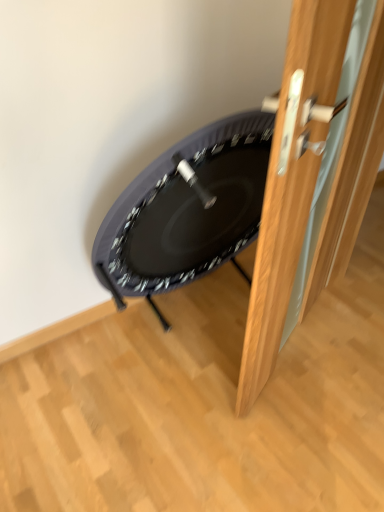
The width and height of the screenshot is (384, 512). Identify the location of free space in front of wooden door at right. (290, 434).